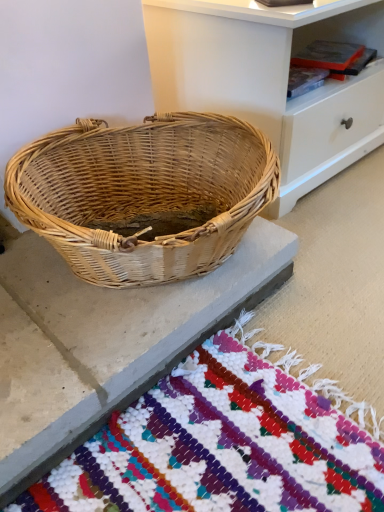
At what (x,y) coordinates should I click in order to perform the action: click on empty space that is ontop of multicolored woven mat at lower center (from a real-world perspective). Please return your answer as a coordinate pair (x, y). The height and width of the screenshot is (512, 384). Looking at the image, I should click on (90, 303).